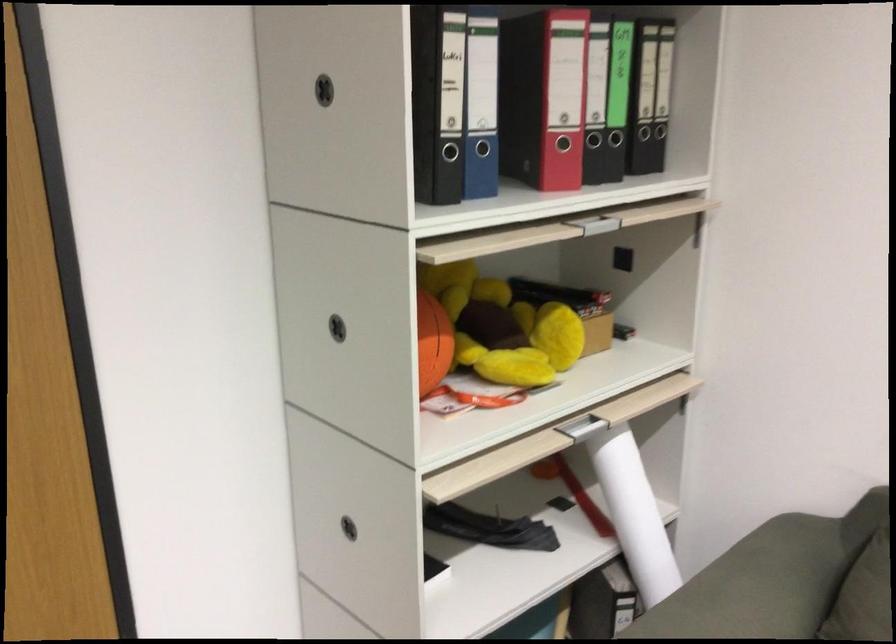
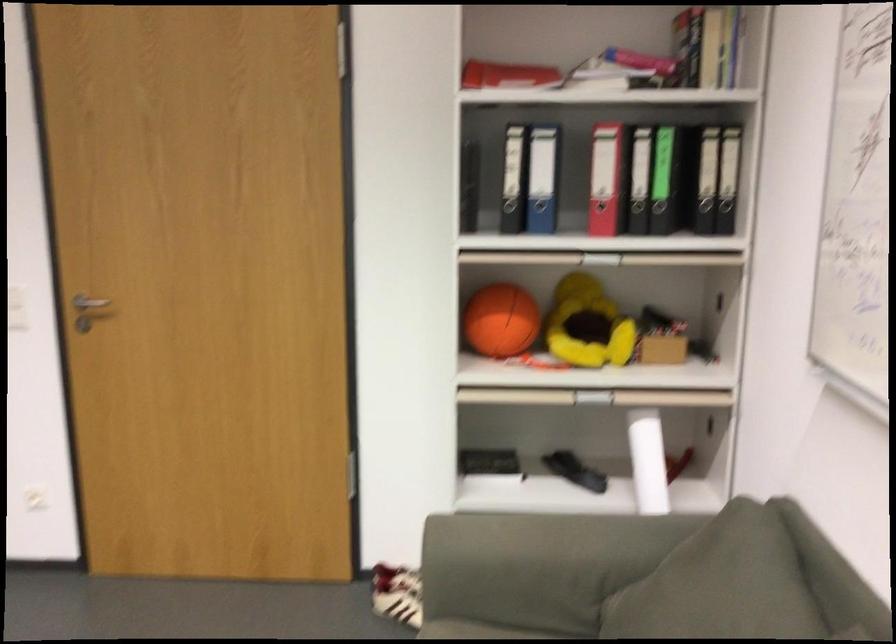
The point at (428, 350) is marked in the first image. Where is the corresponding point in the second image?

(501, 321)